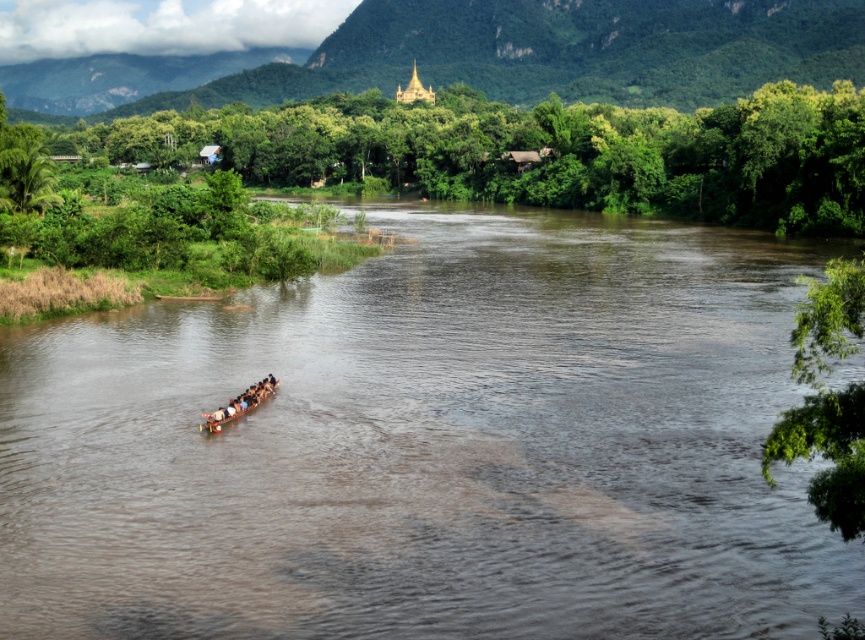
You are standing on the riverbank and see two points in the river. The first point is at coordinates point (671, 332) and the second is at point (207, 417). Which point is closer to you?

Point (671, 332) is closer to you because it is further to the viewer than point (207, 417).

You are a photographer trying to capture the brown wooden canoe at center and the wooden paddle at center in the same frame. Based on their sizes, which object will appear smaller in the photo?

The brown wooden canoe at center is thinner than the wooden paddle at center, so it will appear smaller in the photo.

You are a kayaker preparing to paddle down the river shown in the scene. The kayaker is 1.8 meters tall. If you want to avoid the brown matte water at center, which is 17.72 meters away from you, can you safely navigate around it without getting too close?

The brown matte water at center is 17.72 meters away from the viewer. Since the kayaker is 1.8 meters tall, the distance is sufficient to safely navigate around the water without getting too close.